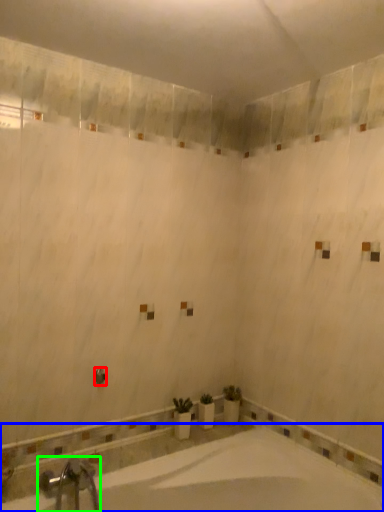
Question: Which object is the closest to the shower (highlighted by a red box)? Choose among these: bathtub (highlighted by a blue box) or tap (highlighted by a green box).

Choices:
 (A) bathtub
 (B) tap

Answer: (B)